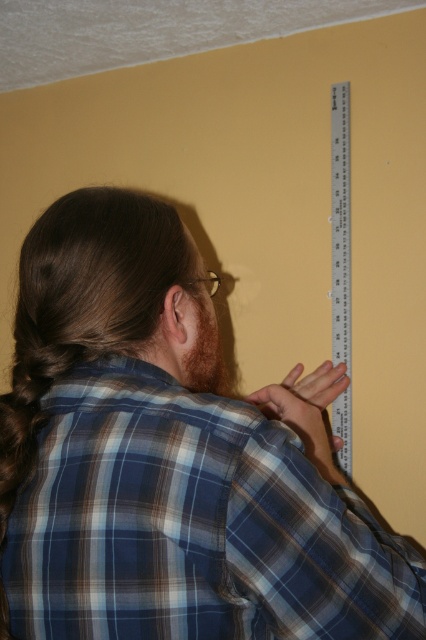
This screenshot has height=640, width=426. What are the coordinates of `blue plaid shirt at upper center` in the screenshot? It's located at (169, 460).

Can you confirm if blue plaid shirt at upper center is taller than clear plastic ruler at upper right?

Incorrect, blue plaid shirt at upper center's height is not larger of clear plastic ruler at upper right's.

Describe the element at coordinates (169, 460) in the screenshot. The image size is (426, 640). I see `blue plaid shirt at upper center` at that location.

The image size is (426, 640). Identify the location of blue plaid shirt at upper center. [x=169, y=460].

Can you confirm if blue plaid shirt at upper center is wider than brown fuzzy beard at back?

→ Correct, the width of blue plaid shirt at upper center exceeds that of brown fuzzy beard at back.

Is blue plaid shirt at upper center shorter than brown fuzzy beard at back?

Incorrect, blue plaid shirt at upper center's height does not fall short of brown fuzzy beard at back's.

Is point (193, 561) closer to viewer compared to point (226, 378)?

Yes, point (193, 561) is closer to viewer.

The width and height of the screenshot is (426, 640). In order to click on blue plaid shirt at upper center in this screenshot , I will do `click(169, 460)`.

Is point (340, 323) farther from camera compared to point (195, 352)?

Yes, point (340, 323) is farther from viewer.

Find the location of a particular element. Image resolution: width=426 pixels, height=640 pixels. clear plastic ruler at upper right is located at coordinates (340, 225).

Where is `clear plastic ruler at upper right`? Image resolution: width=426 pixels, height=640 pixels. clear plastic ruler at upper right is located at coordinates (340, 225).

Find the location of a particular element. Image resolution: width=426 pixels, height=640 pixels. clear plastic ruler at upper right is located at coordinates (340, 225).